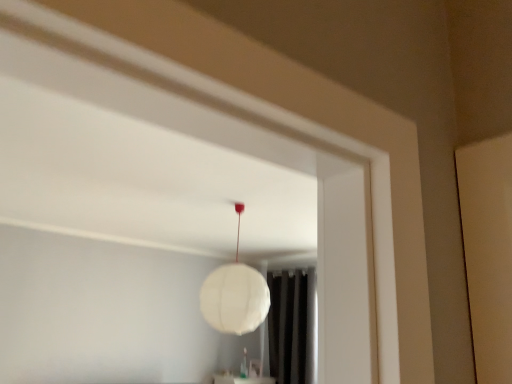
Identify the location of white paper lamp at center. This screenshot has height=384, width=512. (234, 295).

What do you see at coordinates (234, 295) in the screenshot? I see `white paper lamp at center` at bounding box center [234, 295].

Measure the distance between point (x=217, y=319) and camera.

A distance of 8.02 feet exists between point (x=217, y=319) and camera.

This screenshot has width=512, height=384. What do you see at coordinates (292, 326) in the screenshot?
I see `black fabric curtain at lower center` at bounding box center [292, 326].

Find the location of a particular element. The height and width of the screenshot is (384, 512). black fabric curtain at lower center is located at coordinates (292, 326).

Locate an element on the screen. Image resolution: width=512 pixels, height=384 pixels. white paper lamp at center is located at coordinates (234, 295).

In the image, is white paper lamp at center on the left side or the right side of black fabric curtain at lower center?

Clearly, white paper lamp at center is on the left of black fabric curtain at lower center in the image.

Based on the photo, is white paper lamp at center further to camera compared to black fabric curtain at lower center?

No.

Does point (222, 309) come closer to viewer compared to point (295, 381)?

Yes, point (222, 309) is closer to viewer.

From the image's perspective, does white paper lamp at center appear higher than black fabric curtain at lower center?

Yes, from the image's perspective, white paper lamp at center is over black fabric curtain at lower center.

From a real-world perspective, is white paper lamp at center physically above black fabric curtain at lower center?

Correct, in the physical world, white paper lamp at center is higher than black fabric curtain at lower center.

Which object is wider, white paper lamp at center or black fabric curtain at lower center?

With larger width is white paper lamp at center.

Can you confirm if white paper lamp at center is shorter than black fabric curtain at lower center?

Indeed, white paper lamp at center has a lesser height compared to black fabric curtain at lower center.

Looking at the image, does white paper lamp at center seem bigger or smaller compared to black fabric curtain at lower center?

In the image, white paper lamp at center appears to be smaller than black fabric curtain at lower center.

Can we say white paper lamp at center lies outside black fabric curtain at lower center?

That's correct, white paper lamp at center is outside of black fabric curtain at lower center.

Would you say white paper lamp at center is a long distance from black fabric curtain at lower center?

Absolutely, white paper lamp at center is distant from black fabric curtain at lower center.

Is white paper lamp at center turned away from black fabric curtain at lower center?

No, black fabric curtain at lower center is not at the back of white paper lamp at center.

From the picture: Can you tell me how much white paper lamp at center and black fabric curtain at lower center differ in facing direction?

90 degrees.

Locate an element on the screen. Image resolution: width=512 pixels, height=384 pixels. lamp above the black fabric curtain at lower center (from a real-world perspective) is located at coordinates (234, 295).

Considering the relative positions of black fabric curtain at lower center and white paper lamp at center in the image provided, is black fabric curtain at lower center to the right of white paper lamp at center from the viewer's perspective?

Correct, you'll find black fabric curtain at lower center to the right of white paper lamp at center.

Relative to white paper lamp at center, is black fabric curtain at lower center in front or behind?

Clearly, black fabric curtain at lower center is behind white paper lamp at center.

Is point (313, 349) positioned in front of point (224, 331)?

No, it is behind (224, 331).

Consider the image. From the image's perspective, which is above, black fabric curtain at lower center or white paper lamp at center?

white paper lamp at center appears higher in the image.

From a real-world perspective, which is physically above, black fabric curtain at lower center or white paper lamp at center?

In real-world perspective, white paper lamp at center is above.

Is black fabric curtain at lower center wider than white paper lamp at center?

No.

Considering the relative sizes of black fabric curtain at lower center and white paper lamp at center in the image provided, is black fabric curtain at lower center taller than white paper lamp at center?

Indeed, black fabric curtain at lower center has a greater height compared to white paper lamp at center.

Can you confirm if black fabric curtain at lower center is bigger than white paper lamp at center?

Yes, black fabric curtain at lower center is bigger than white paper lamp at center.

Is black fabric curtain at lower center inside the boundaries of white paper lamp at center, or outside?

The correct answer is: outside.

Is black fabric curtain at lower center with white paper lamp at center?

No.

Does black fabric curtain at lower center turn towards white paper lamp at center?

No, black fabric curtain at lower center does not turn towards white paper lamp at center.

What's the angular difference between black fabric curtain at lower center and white paper lamp at center's facing directions?

There is a 90-degree angle between the facing directions of black fabric curtain at lower center and white paper lamp at center.

Where is `curtain on the right side of white paper lamp at center`? curtain on the right side of white paper lamp at center is located at coordinates (292, 326).

Where is `curtain on the right of white paper lamp at center`? Image resolution: width=512 pixels, height=384 pixels. curtain on the right of white paper lamp at center is located at coordinates (292, 326).

The image size is (512, 384). Find the location of `lamp above the black fabric curtain at lower center (from the image's perspective)`. lamp above the black fabric curtain at lower center (from the image's perspective) is located at coordinates (234, 295).